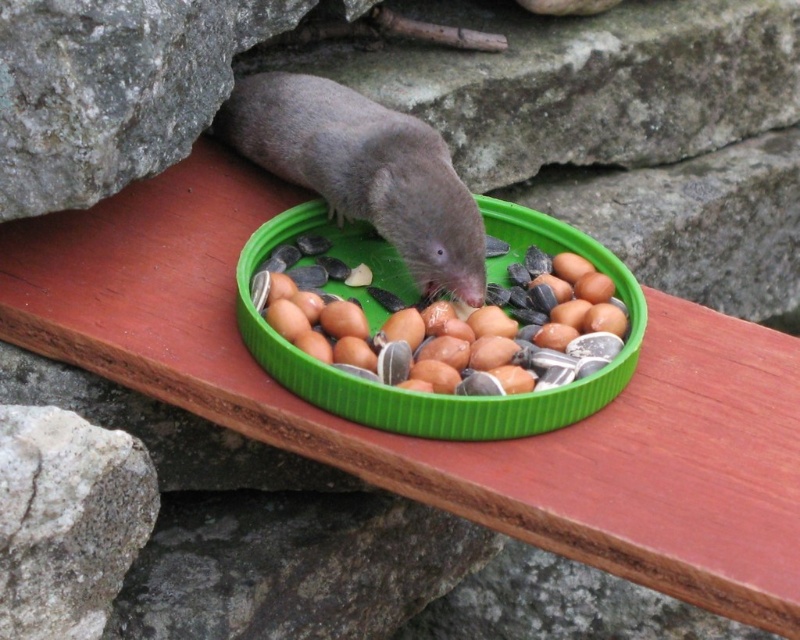
The width and height of the screenshot is (800, 640). Identify the location of brown matte seeds at center. (458, 330).

At what (x,y) coordinates should I click in order to perform the action: click on brown matte seeds at center. Please return your answer as a coordinate pair (x, y). The width and height of the screenshot is (800, 640). Looking at the image, I should click on (458, 330).

Who is positioned more to the left, gray rough stone at upper right or gray matte/metallic mole at center?

From the viewer's perspective, gray matte/metallic mole at center appears more on the left side.

Looking at this image, can you confirm if gray rough stone at upper right is taller than gray matte/metallic mole at center?

Correct, gray rough stone at upper right is much taller as gray matte/metallic mole at center.

The image size is (800, 640). In order to click on gray rough stone at upper right in this screenshot , I will do `click(692, 220)`.

Where is `gray rough stone at upper right`? The height and width of the screenshot is (640, 800). gray rough stone at upper right is located at coordinates (692, 220).

Is gray matte/metallic mole at center above gray rough stone at lower left?

Yes.

Is gray matte/metallic mole at center thinner than gray rough stone at lower left?

In fact, gray matte/metallic mole at center might be wider than gray rough stone at lower left.

Is point (460, 273) more distant than point (57, 452)?

Yes, point (460, 273) is behind point (57, 452).

Locate an element on the screen. Image resolution: width=800 pixels, height=640 pixels. gray matte/metallic mole at center is located at coordinates (364, 172).